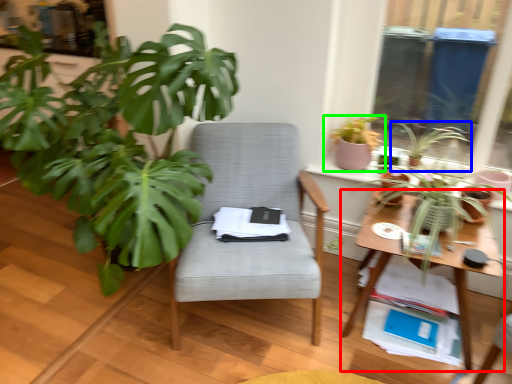
Question: Based on their relative distances, which object is nearer to table (highlighted by a red box)? Choose from houseplant (highlighted by a blue box) and houseplant (highlighted by a green box).

Choices:
 (A) houseplant
 (B) houseplant

Answer: (A)